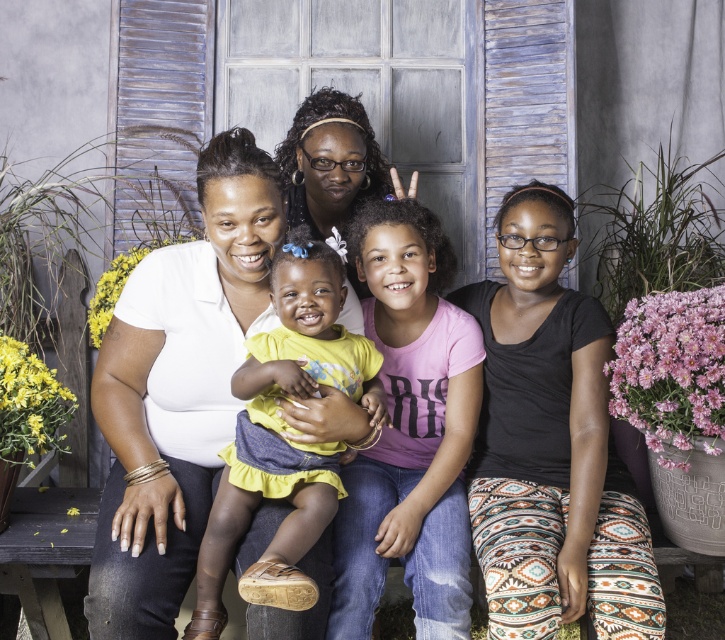
Question: Which object is positioned farthest from the pink matte shirt at center?

Choices:
 (A) yellow matte dress at center
 (B) white matte shirt at center

Answer: (A)

Question: Where is yellow matte dress at center located in relation to white matte shirt at center in the image?

Choices:
 (A) above
 (B) below

Answer: (A)

Question: Which is nearer to the white matte shirt at center?

Choices:
 (A) pink matte shirt at center
 (B) yellow matte dress at center

Answer: (A)

Question: In this image, where is pink matte shirt at center located relative to white matte shirt at center?

Choices:
 (A) above
 (B) below

Answer: (A)

Question: Which of the following is the farthest from the observer?

Choices:
 (A) white matte shirt at center
 (B) yellow matte dress at center

Answer: (A)

Question: Observing the image, what is the correct spatial positioning of pink matte shirt at center in reference to yellow matte dress at center?

Choices:
 (A) above
 (B) below

Answer: (A)